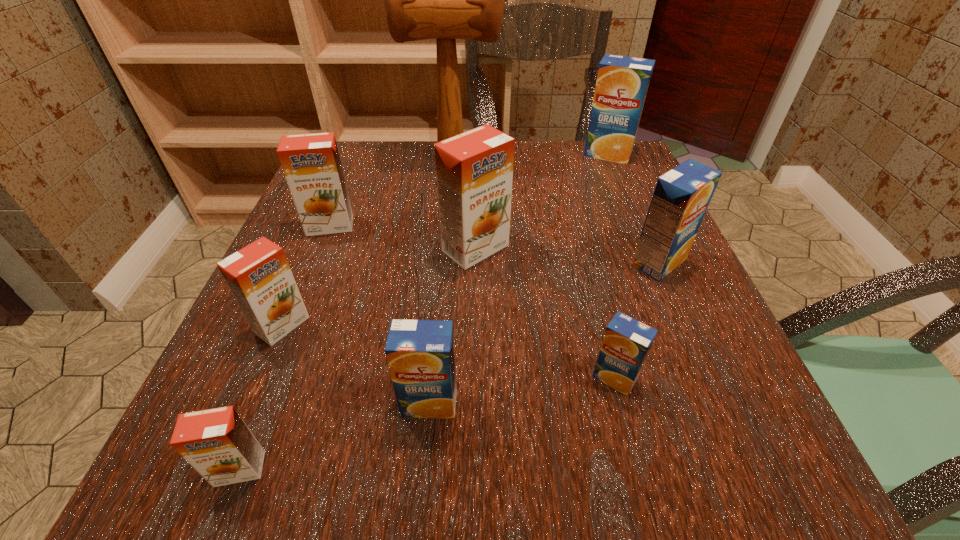
You are a GUI agent. You are given a task and a screenshot of the screen. Output one action in this format:
    pyautogui.click(x=<x>, y=<y>)
    Task: Click on the free space between the biggest blue orange_juice and the mallet
    Image resolution: width=960 pixels, height=540 pixels.
    Given the screenshot: What is the action you would take?
    pyautogui.click(x=530, y=157)

The height and width of the screenshot is (540, 960). I want to click on object that is the sixth nearest to the farthest blue orange_juice, so click(420, 353).

The image size is (960, 540). Find the location of `the second closest object to the second biggest orange orange juice`. the second closest object to the second biggest orange orange juice is located at coordinates (474, 169).

Select which orange juice appears as the third closest to the nearest orange orange juice. Please provide its 2D coordinates. Your answer should be formatted as a tuple, i.e. [(x, y)], where the tuple contains the x and y coordinates of a point satisfying the conditions above.

[(474, 169)]

Where is `orange juice that stands as the closest to the mallet`? This screenshot has width=960, height=540. orange juice that stands as the closest to the mallet is located at coordinates (311, 163).

Find the location of `blue orange_juice identified as the closest to the third orange juice from right to left`. blue orange_juice identified as the closest to the third orange juice from right to left is located at coordinates (681, 197).

Find the location of a particular element. The width and height of the screenshot is (960, 540). blue orange_juice that can be found as the closest to the mallet is located at coordinates (622, 82).

Identify which orange orange juice is the third nearest to the leftmost blue orange_juice. Please provide its 2D coordinates. Your answer should be formatted as a tuple, i.e. [(x, y)], where the tuple contains the x and y coordinates of a point satisfying the conditions above.

[(474, 169)]

Find the location of `the third closest orange orange juice to the third smallest orange orange juice`. the third closest orange orange juice to the third smallest orange orange juice is located at coordinates (217, 443).

Where is `free space that satisfies the following two spatial constraints: 1. on the back side of the farthest orange juice; 2. on the left side of the second biggest orange orange juice`? This screenshot has height=540, width=960. free space that satisfies the following two spatial constraints: 1. on the back side of the farthest orange juice; 2. on the left side of the second biggest orange orange juice is located at coordinates (358, 154).